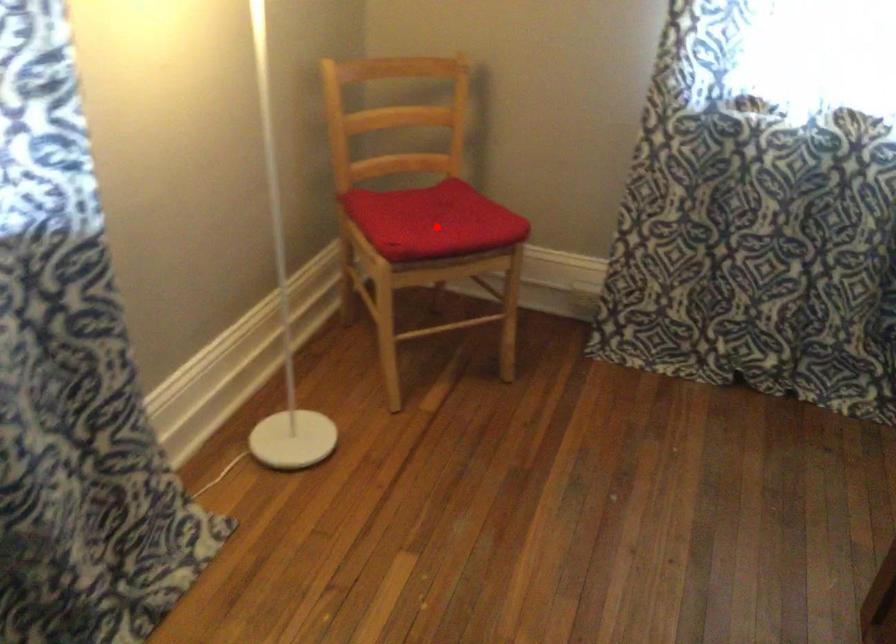
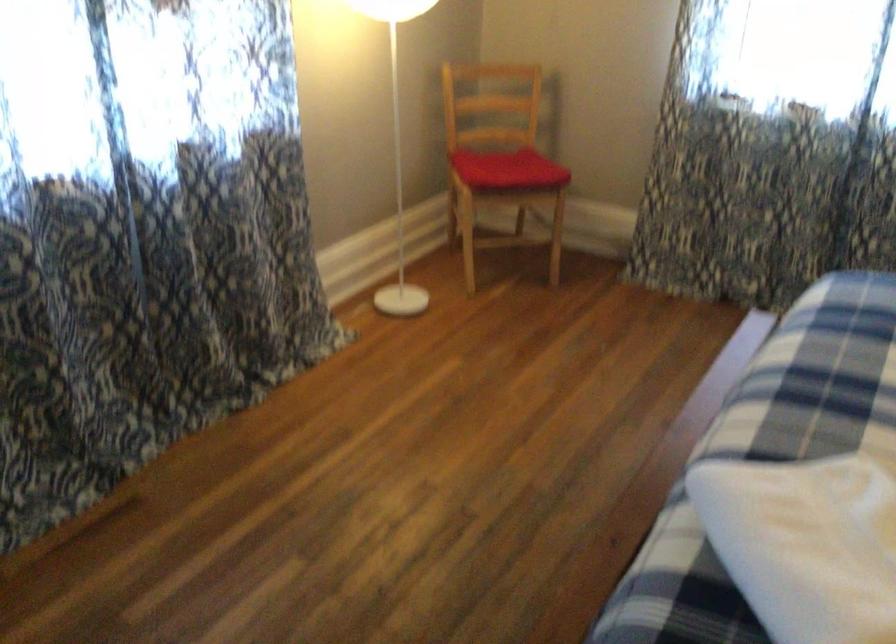
Question: A red point is marked in image1. In image2, is the corresponding 3D point closer to the camera or farther? Reply with the corresponding letter.

Choices:
 (A) The corresponding 3D point is closer.
 (B) The corresponding 3D point is farther.

Answer: (B)